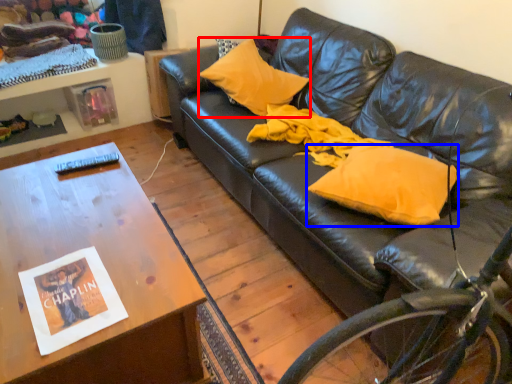
Question: Among these objects, which one is farthest to the camera, pillow (highlighted by a red box) or pillow (highlighted by a blue box)?

Choices:
 (A) pillow
 (B) pillow

Answer: (A)